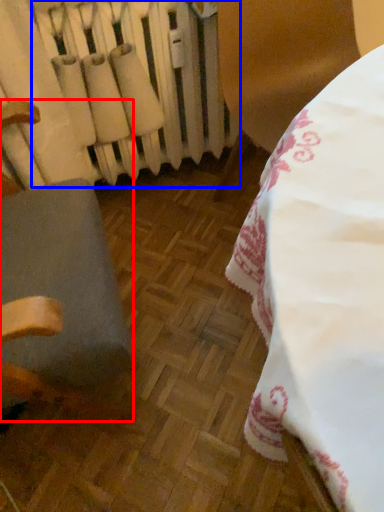
Question: Which point is closer to the camera, furniture (highlighted by a red box) or radiator (highlighted by a blue box)?

Choices:
 (A) furniture
 (B) radiator

Answer: (A)